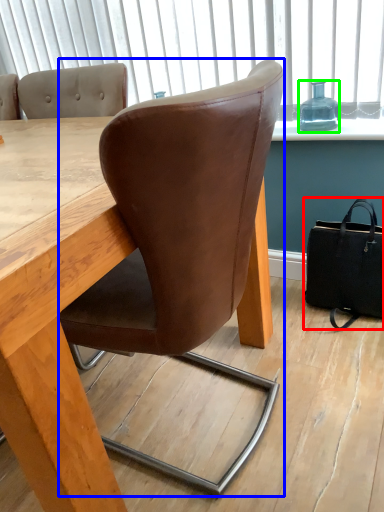
Question: Which object is the farthest from handbag (highlighted by a red box)? Choose among these: chair (highlighted by a blue box) or bottle (highlighted by a green box).

Choices:
 (A) chair
 (B) bottle

Answer: (A)